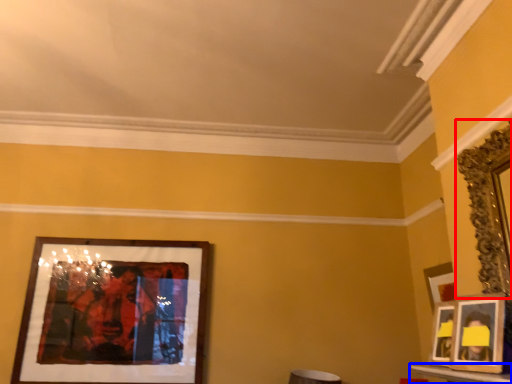
Question: Which object is closer to the camera taking this photo, picture frame (highlighted by a red box) or table (highlighted by a blue box)?

Choices:
 (A) picture frame
 (B) table

Answer: (B)